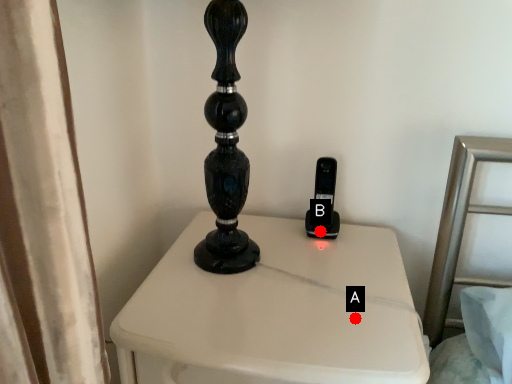
Question: Two points are circled on the image, labeled by A and B beside each circle. Which point is closer to the camera?

Choices:
 (A) A is closer
 (B) B is closer

Answer: (A)